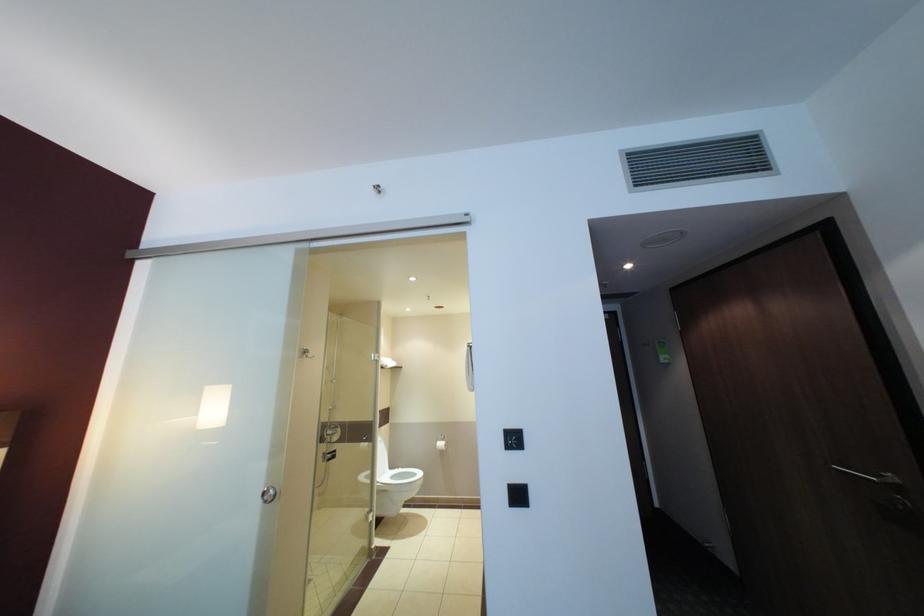
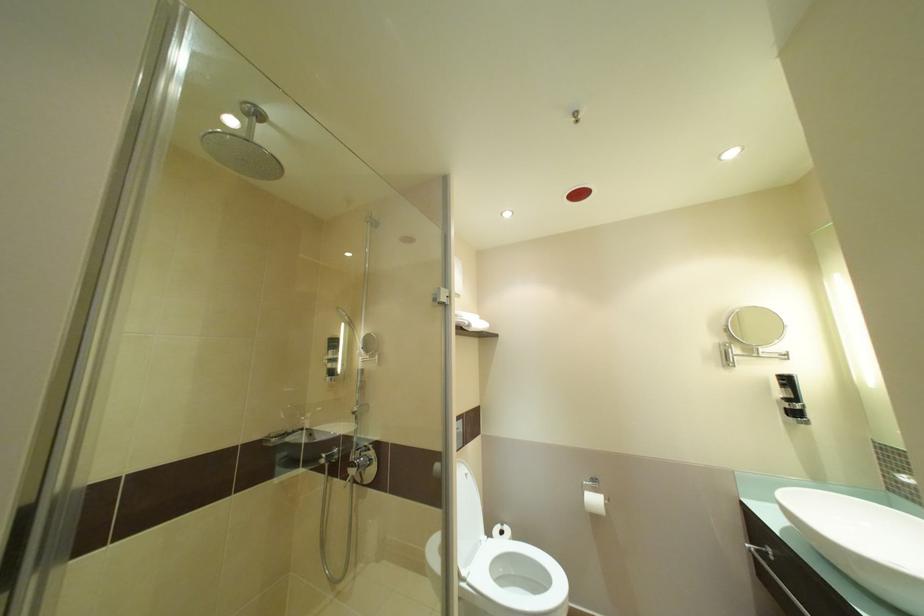
Question: The images are taken continuously from a first-person perspective. In which direction are you moving?

Choices:
 (A) Left
 (B) Right
 (C) Forward
 (D) Backward

Answer: (C)